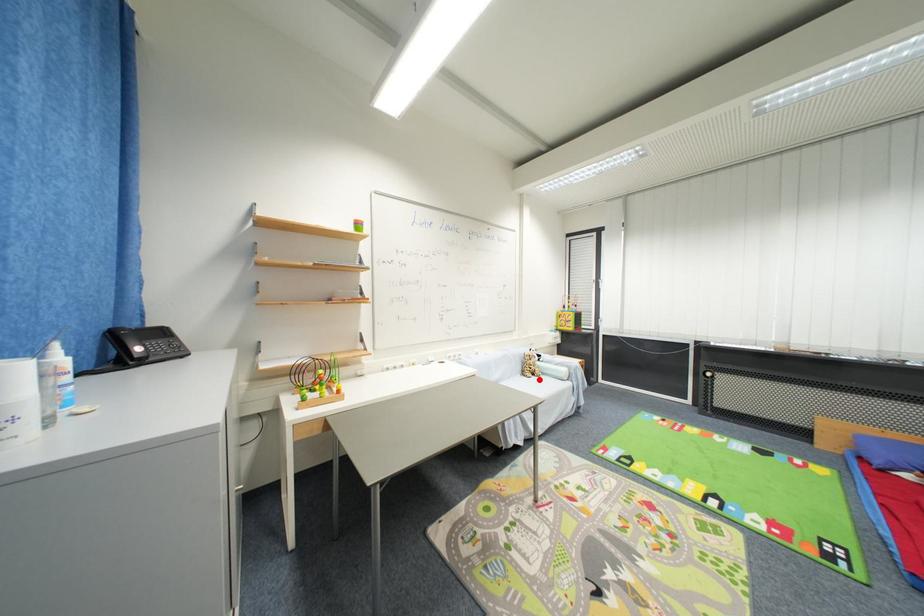
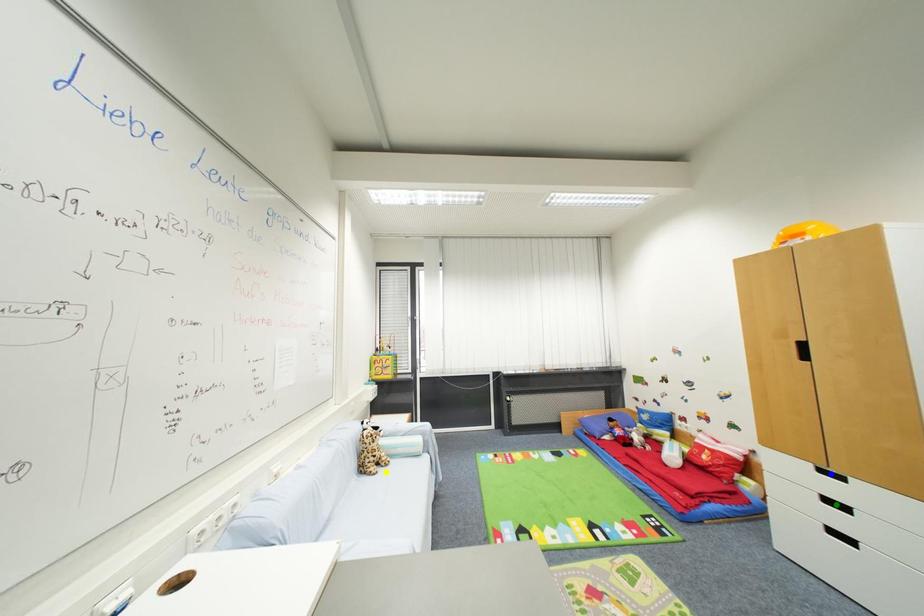
Question: I am providing you with two images of the same scene from different viewpoints. A red point is marked on the first image. You are given multiple points on the second image. In image 2, which mark is for the same physical point as the one in image 1?

Choices:
 (A) green point
 (B) blue point
 (C) yellow point

Answer: (C)